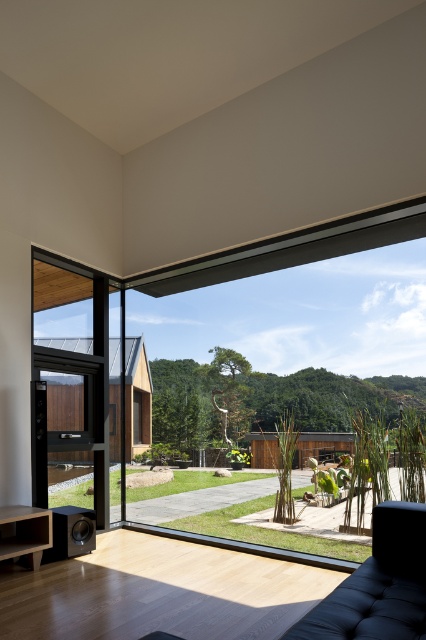
Is transparent glass window at center smaller than black tufted couch at lower right?

Incorrect, transparent glass window at center is not smaller in size than black tufted couch at lower right.

Can you confirm if transparent glass window at center is taller than black tufted couch at lower right?

Correct, transparent glass window at center is much taller as black tufted couch at lower right.

Between point (388, 285) and point (403, 524), which one is positioned in front?

Point (403, 524) is in front.

I want to click on transparent glass window at center, so click(273, 376).

Which of these two, transparent wood glass door at left or black tufted couch at lower right, stands taller?

transparent wood glass door at left

How distant is transparent wood glass door at left from black tufted couch at lower right?

A distance of 2.71 meters exists between transparent wood glass door at left and black tufted couch at lower right.

Locate an element on the screen. This screenshot has height=640, width=426. transparent wood glass door at left is located at coordinates (69, 428).

The height and width of the screenshot is (640, 426). I want to click on transparent wood glass door at left, so click(x=69, y=428).

Measure the distance between transparent glass window at center and transparent wood glass door at left.

The distance of transparent glass window at center from transparent wood glass door at left is 4.33 meters.

Does transparent glass window at center appear on the right side of transparent wood glass door at left?

Indeed, transparent glass window at center is positioned on the right side of transparent wood glass door at left.

The image size is (426, 640). Describe the element at coordinates (273, 376) in the screenshot. I see `transparent glass window at center` at that location.

Identify the location of transparent glass window at center. The width and height of the screenshot is (426, 640). (273, 376).